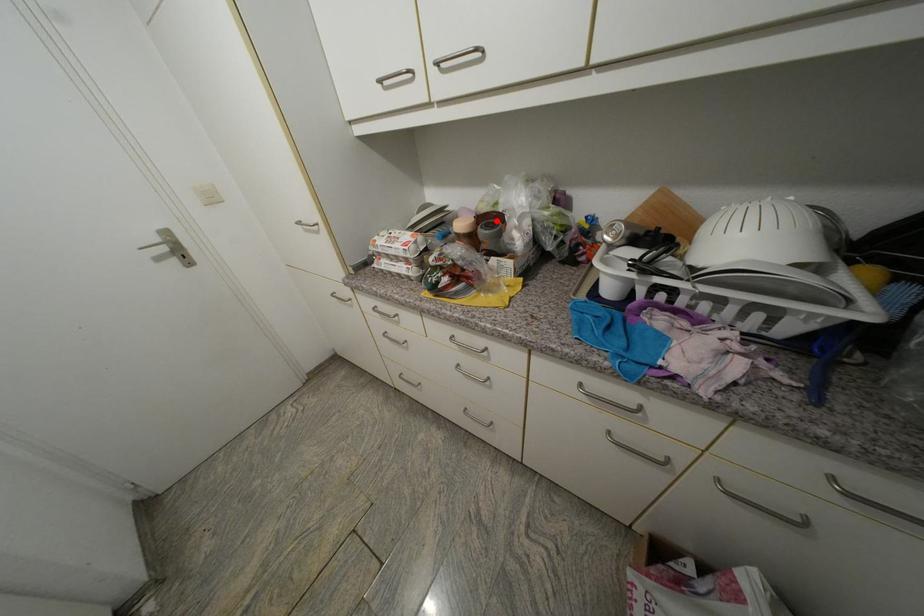
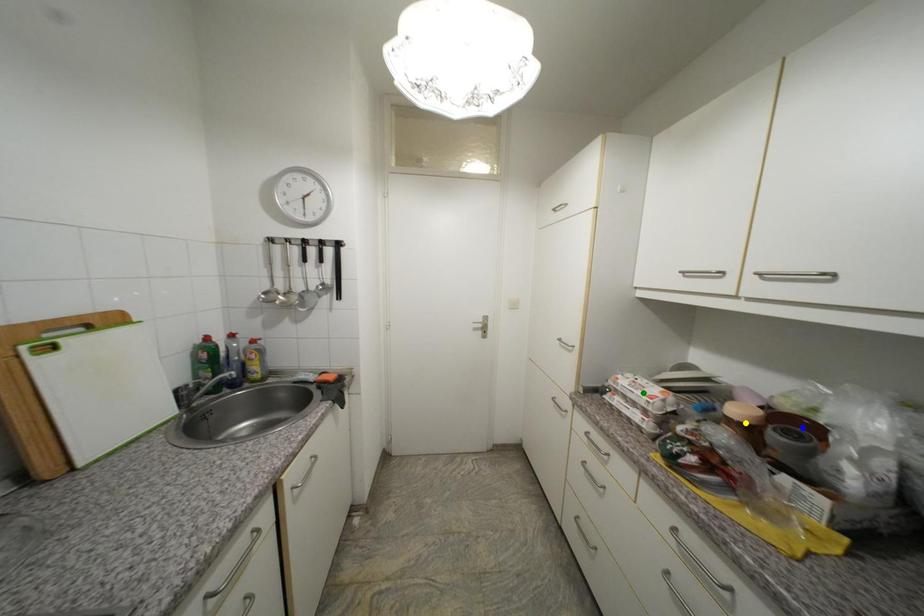
Question: I am providing you with two images of the same scene from different viewpoints. A red point is marked on the first image. You are given multiple points on the second image. Which mark in image 2 goes with the point in image 1?

Choices:
 (A) yellow point
 (B) blue point
 (C) green point

Answer: (B)